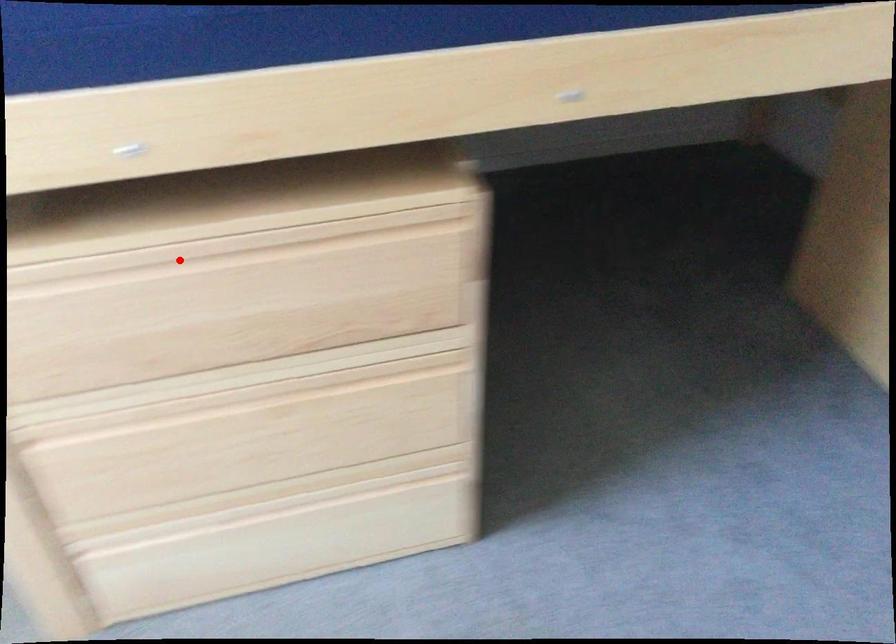
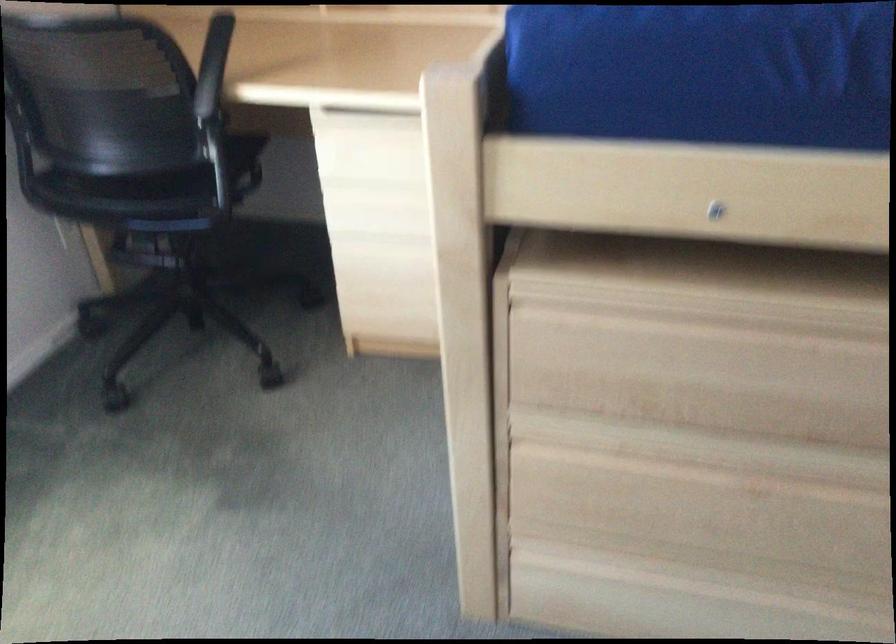
In the second image, find the point that corresponds to the highlighted location in the first image.

(711, 321)